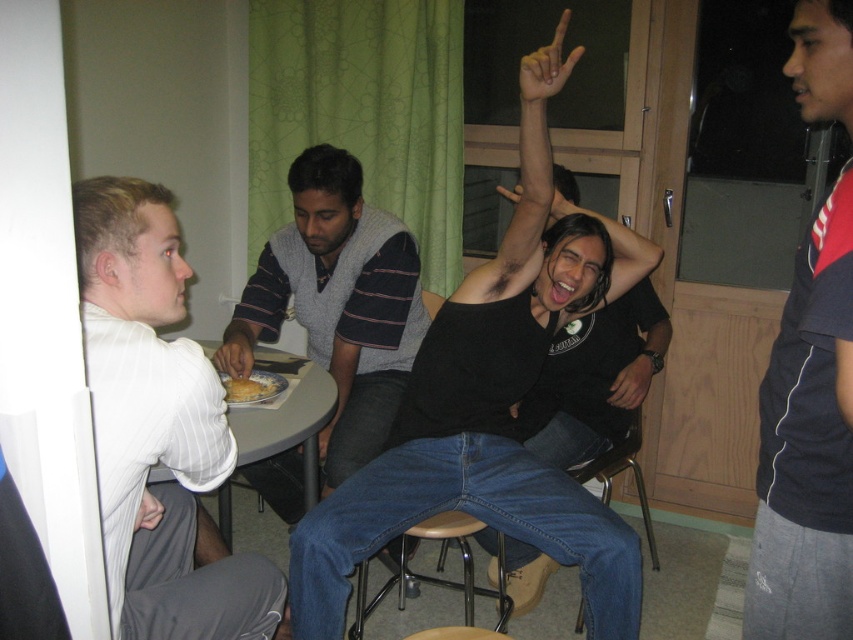
Does black matte shirt at center have a larger size compared to white striped shirt at left?

Yes.

Which is in front, point (289, 611) or point (126, 545)?

Point (126, 545)

I want to click on black matte shirt at center, so click(489, 417).

Can you confirm if yellow painted finger at upper center is taller than matte plastic fork at lower center?

Yes, yellow painted finger at upper center is taller than matte plastic fork at lower center.

Does yellow painted finger at upper center have a smaller size compared to matte plastic fork at lower center?

Correct, yellow painted finger at upper center occupies less space than matte plastic fork at lower center.

Who is more distant from viewer, (x=524, y=56) or (x=231, y=362)?

Positioned behind is point (x=231, y=362).

In order to click on yellow painted finger at upper center in this screenshot , I will do `click(546, 67)`.

Based on the photo, can you confirm if dark blue jersey at upper right is wider than golden brown bread at center?

No.

Image resolution: width=853 pixels, height=640 pixels. Identify the location of dark blue jersey at upper right. (807, 445).

Is point (786, 499) positioned before point (236, 390)?

That is True.

Find the location of `dark blue jersey at upper right`. dark blue jersey at upper right is located at coordinates (807, 445).